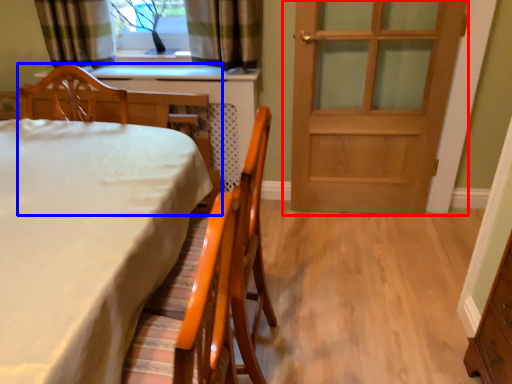
Question: Which object appears closest to the camera in this image, door (highlighted by a red box) or chair (highlighted by a blue box)?

Choices:
 (A) door
 (B) chair

Answer: (B)